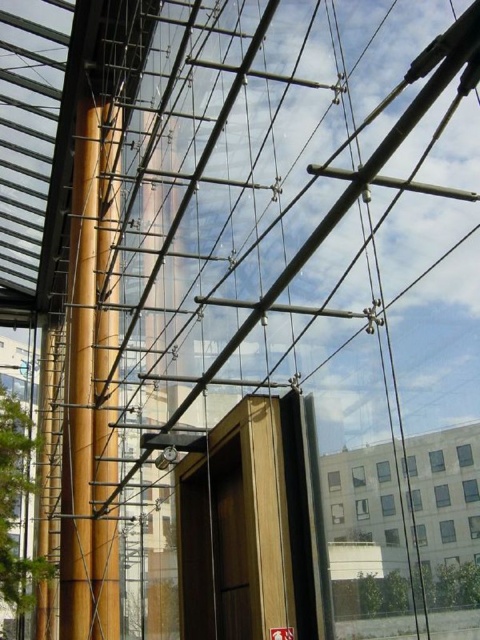
You are an architect designing a new building and you want to place a decorative wooden pole at center and a yellow matte pole at center in the structure. According to the current design shown in the image, which pole is positioned higher?

The wooden pole at center is above the yellow matte pole at center, so the wooden pole at center is positioned higher.

You are a maintenance worker needing to replace a clamp between the wooden pole at center and the yellow matte pole at center. The clamp you have is designed to fit a gap of 2 meters. Will the clamp fit between them?

The distance between the wooden pole at center and the yellow matte pole at center is 2.16 meters, which is wider than the clamp designed for 2 meters. Therefore, the clamp will not fit between them.